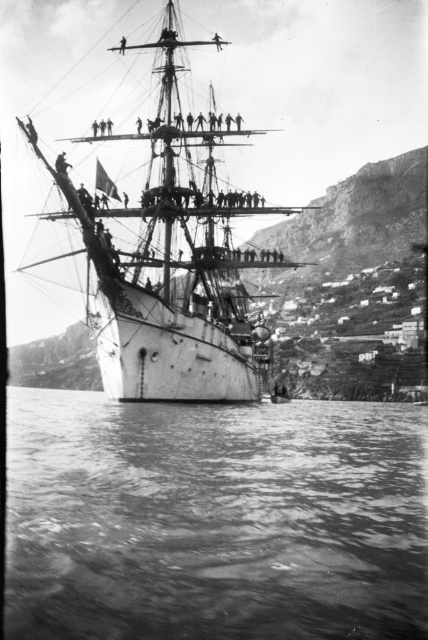
Question: Is smooth water at lower center wider than white matte ship at center?

Choices:
 (A) yes
 (B) no

Answer: (A)

Question: Where is smooth water at lower center located in relation to white matte ship at center in the image?

Choices:
 (A) left
 (B) right

Answer: (A)

Question: Which point appears farthest from the camera in this image?

Choices:
 (A) (157, 388)
 (B) (177, 618)

Answer: (A)

Question: Which point is closer to the camera taking this photo?

Choices:
 (A) pyautogui.click(x=323, y=499)
 (B) pyautogui.click(x=89, y=300)

Answer: (A)

Question: Among these objects, which one is farthest from the camera?

Choices:
 (A) smooth water at lower center
 (B) white matte ship at center

Answer: (B)

Question: Observing the image, what is the correct spatial positioning of smooth water at lower center in reference to white matte ship at center?

Choices:
 (A) above
 (B) below

Answer: (B)